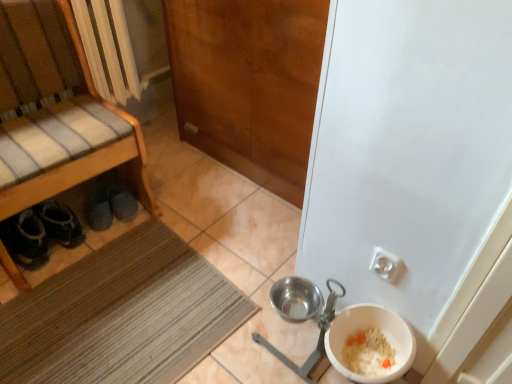
This screenshot has width=512, height=384. In order to click on vacant area that is situated to the right of wooden bench at left in this screenshot , I will do `click(184, 233)`.